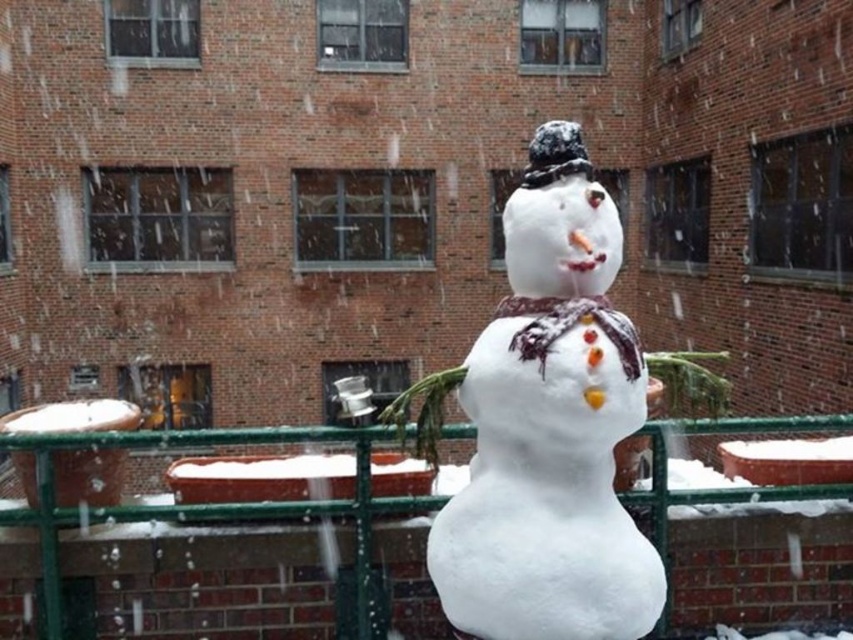
You are a photographer wanting to capture the white fluffy snowman at center and the green metal fence at center in the same frame. Based on their positions, will you need to adjust your camera angle to include both?

The white fluffy snowman at center is in front of the green metal fence at center, so you can capture both in the same frame without needing to adjust the camera angle since the snowman is already positioned in front of the fence.

You are standing in the middle of a snowy field and see the white fluffy snowman at center and the green metal fence at center. Which object is closer to your right side?

The white fluffy snowman at center is closer to your right side because it is positioned to the right of the green metal fence at center.

You are a photographer trying to capture a photo of the white fluffy snowman at center and the green metal fence at center. Based on their widths, which object should you focus on first if you want to ensure both are fully visible in the frame?

The white fluffy snowman at center has a lesser width compared to the green metal fence at center, so you should focus on the green metal fence at center first to ensure it fits properly in the frame, allowing space for the smaller snowman as well.